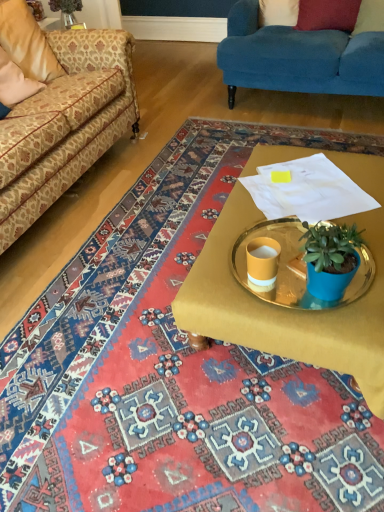
This screenshot has width=384, height=512. I want to click on free location to the left of gold metallic tray at center, so click(112, 307).